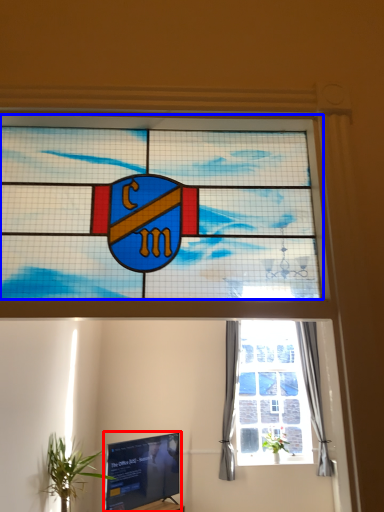
Question: Which point is further to the camera, television (highlighted by a red box) or window (highlighted by a blue box)?

Choices:
 (A) television
 (B) window

Answer: (A)